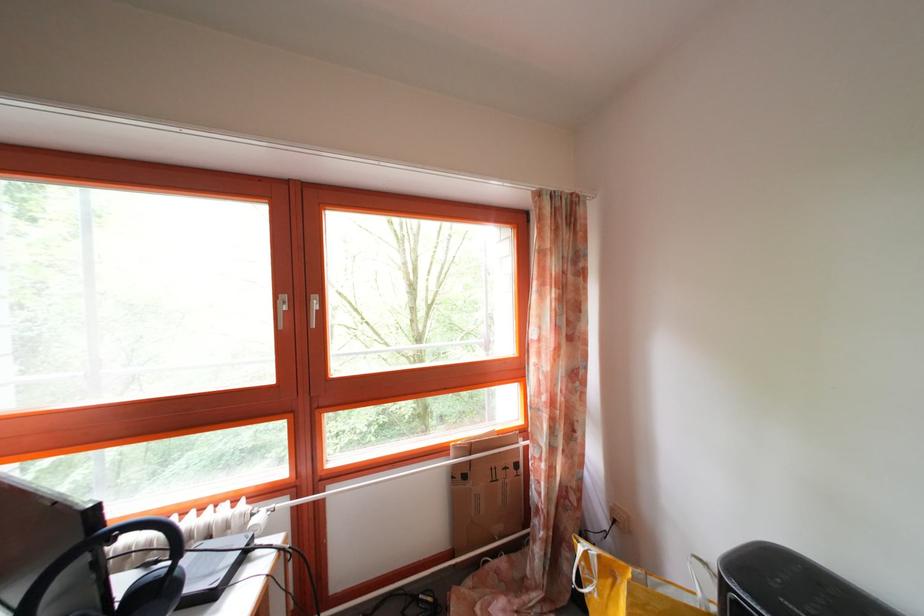
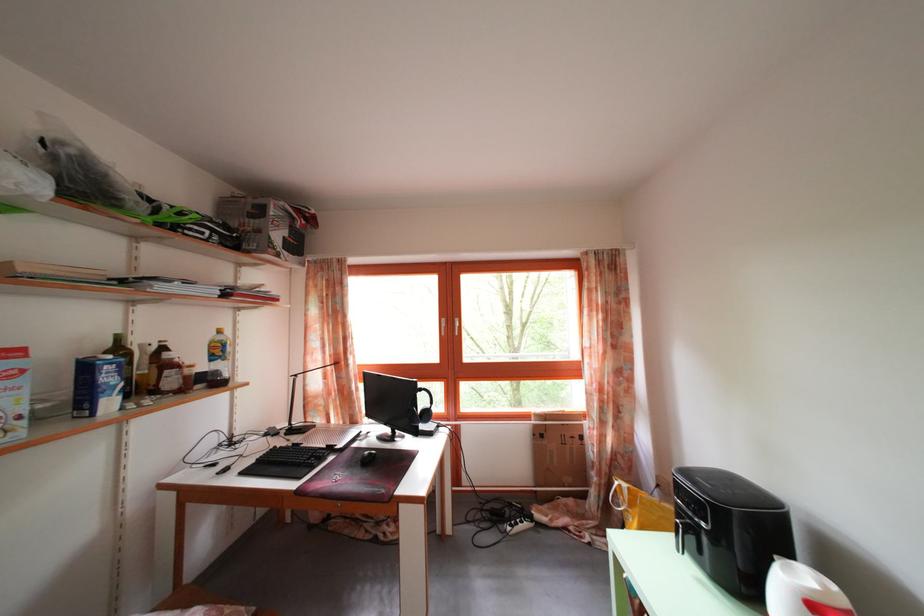
Question: In a continuous first-person perspective shot, in which direction is the camera moving?

Choices:
 (A) Left
 (B) Right
 (C) Forward
 (D) Backward

Answer: (D)